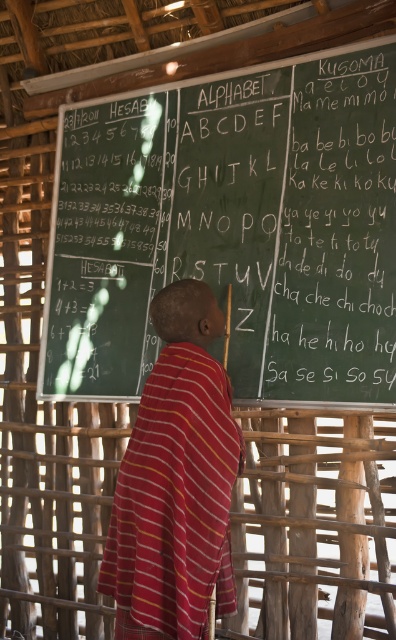
Question: Which object is farther from the camera taking this photo?

Choices:
 (A) striped cotton robe at center
 (B) green chalkboard at upper center

Answer: (B)

Question: Does green chalkboard at upper center appear under striped cotton robe at center?

Choices:
 (A) yes
 (B) no

Answer: (B)

Question: Does green chalkboard at upper center have a larger size compared to striped cotton robe at center?

Choices:
 (A) yes
 (B) no

Answer: (A)

Question: Observing the image, what is the correct spatial positioning of green chalkboard at upper center in reference to striped cotton robe at center?

Choices:
 (A) above
 (B) below

Answer: (A)

Question: Which point is farther from the camera taking this photo?

Choices:
 (A) (112, 520)
 (B) (312, 243)

Answer: (B)